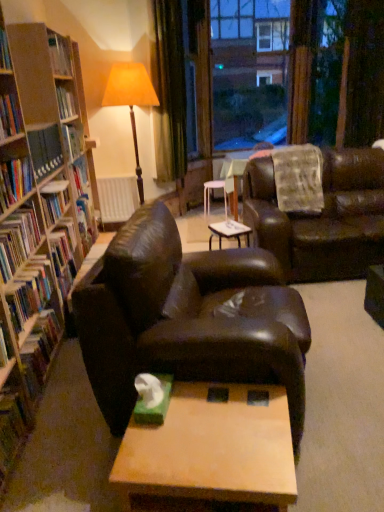
Find the location of a particular element. The image size is (384, 512). free spot to the right of green matte tissue box at center is located at coordinates pos(190,406).